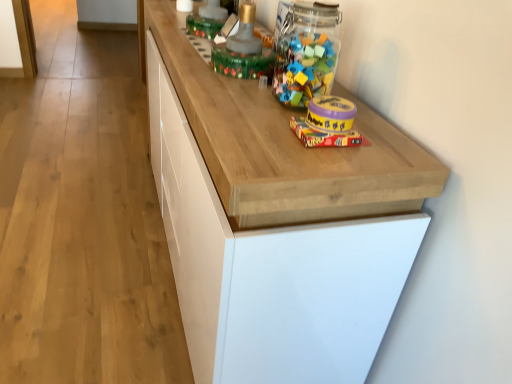
Identify the location of vacant space situated on the left part of matte yellow plastic container at center, the second toy in the front-to-back sequence. Image resolution: width=512 pixels, height=384 pixels. (253, 118).